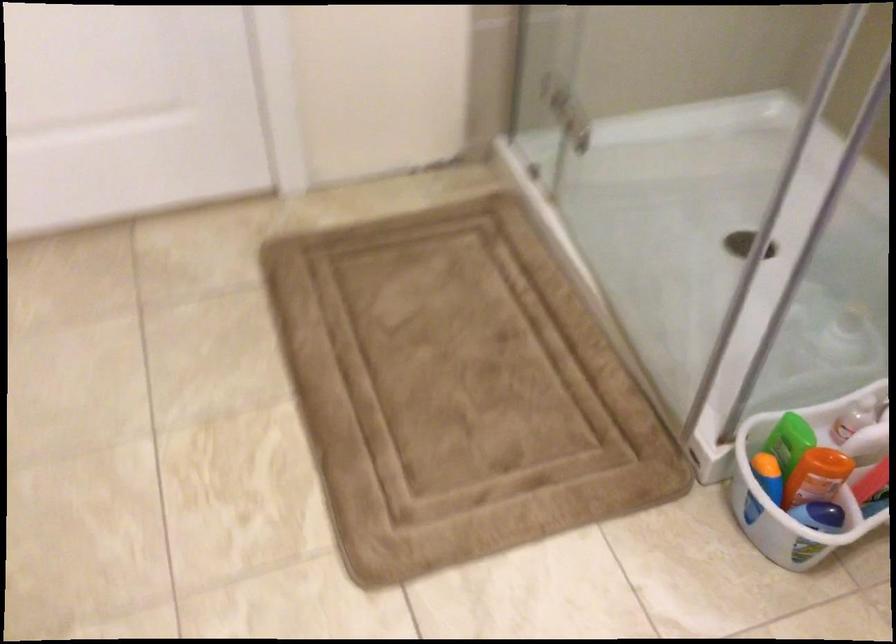
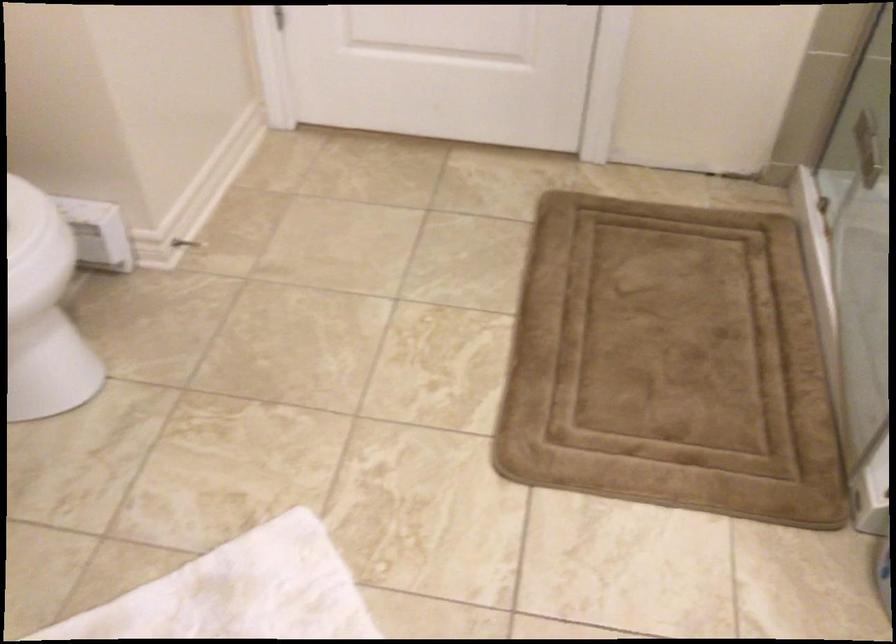
Question: I am providing you with two images of the same scene from different viewpoints. After the viewpoint changes to image2, which objects are now occluded?

Choices:
 (A) brown bath mat
 (B) white bath mat
 (C) metal doorstop
 (D) none of these

Answer: (D)